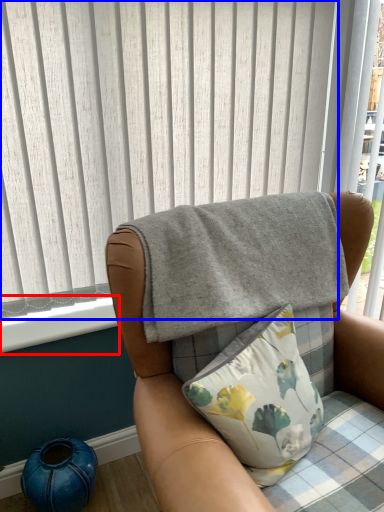
Question: Which object is further to the camera taking this photo, window sill (highlighted by a red box) or curtain (highlighted by a blue box)?

Choices:
 (A) window sill
 (B) curtain

Answer: (A)